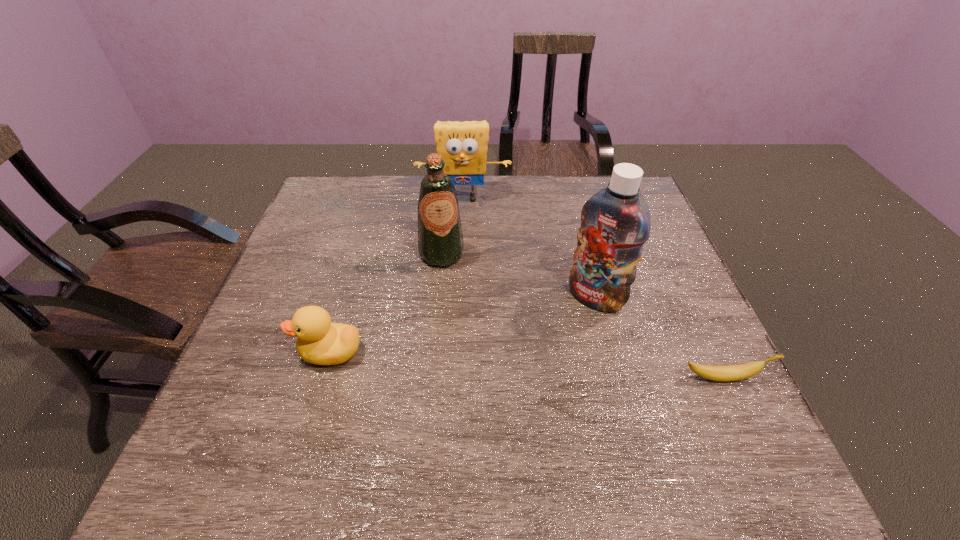
Locate an element on the screen. the leftmost object is located at coordinates (321, 342).

Where is `duck`? Image resolution: width=960 pixels, height=540 pixels. duck is located at coordinates (321, 342).

You are a GUI agent. You are given a task and a screenshot of the screen. Output one action in this format:
    pyautogui.click(x=<x>, y=<y>)
    Task: Click on the shortest object
    The image size is (960, 540).
    Given the screenshot: What is the action you would take?
    pyautogui.click(x=735, y=372)

Locate an element on the screen. This screenshot has height=540, width=960. the nearest object is located at coordinates (735, 372).

Where is `the third nearest object`? Image resolution: width=960 pixels, height=540 pixels. the third nearest object is located at coordinates (615, 222).

Where is `shampoo`? The width and height of the screenshot is (960, 540). shampoo is located at coordinates (615, 222).

Where is `the farthest object`? the farthest object is located at coordinates (462, 145).

The height and width of the screenshot is (540, 960). I want to click on sponge, so click(462, 145).

Find the location of `olive oil`. olive oil is located at coordinates (440, 239).

Locate an element on the screen. the second farthest object is located at coordinates point(440,239).